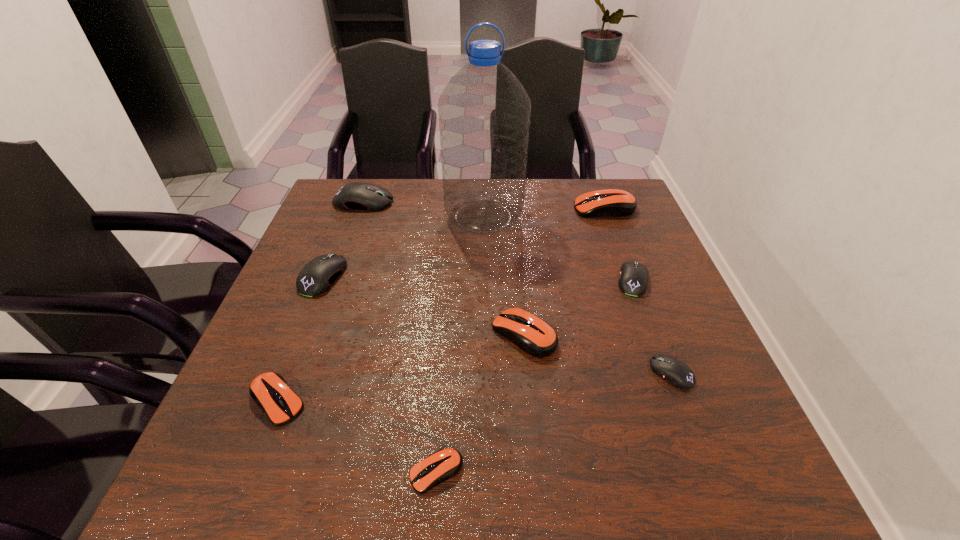
Locate an element on the screen. The height and width of the screenshot is (540, 960). vacant region located on the back of the third biggest orange computer mouse is located at coordinates (307, 323).

This screenshot has height=540, width=960. Find the location of `vacant space located on the back of the nearest black computer equipment`. vacant space located on the back of the nearest black computer equipment is located at coordinates (632, 269).

At what (x,y) coordinates should I click in order to perform the action: click on free region located on the back of the nearest computer mouse. Please return your answer as a coordinate pair (x, y). Looking at the image, I should click on (444, 377).

I want to click on water jug located in the far edge section of the desktop, so click(x=484, y=111).

In order to click on object that is at the near edge in this screenshot , I will do `click(445, 463)`.

Where is `object that is at the far left corner`? object that is at the far left corner is located at coordinates (353, 196).

I want to click on object that is at the far right corner, so click(x=611, y=202).

You are a GUI agent. You are given a task and a screenshot of the screen. Output one action in this format:
    pyautogui.click(x=<x>, y=<y>)
    Task: Click on the free space at the far edge of the desktop
    This screenshot has height=540, width=960.
    Given the screenshot: What is the action you would take?
    pyautogui.click(x=399, y=220)

Find the location of a particular element. vacant space at the near edge of the desktop is located at coordinates (405, 495).

At what (x,y) coordinates should I click in order to perform the action: click on free location at the left edge. Please return your answer as a coordinate pair (x, y). Looking at the image, I should click on (325, 222).